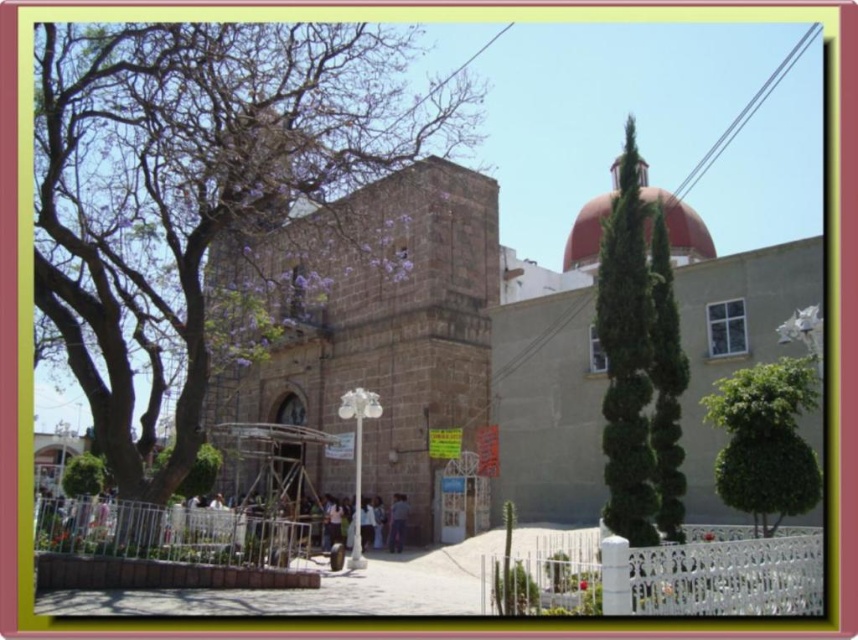
Question: Is the position of green leafy tree at lower right more distant than that of green textured bush at center?

Choices:
 (A) yes
 (B) no

Answer: (B)

Question: Is green textured cone at center below green leafy tree at lower right?

Choices:
 (A) no
 (B) yes

Answer: (A)

Question: Among these points, which one is farthest from the camera?

Choices:
 (A) (200, 211)
 (B) (460, 269)

Answer: (B)

Question: Can you confirm if brown stone church at center is bigger than green textured bush at center?

Choices:
 (A) yes
 (B) no

Answer: (A)

Question: Which is farther from the green textured cone at center?

Choices:
 (A) brown stone church at center
 (B) green leafy tree at lower right
 (C) bare wood tree at left

Answer: (C)

Question: Which point appears farthest from the camera in this image?

Choices:
 (A) (270, 320)
 (B) (798, 496)
 (C) (497, 422)

Answer: (A)